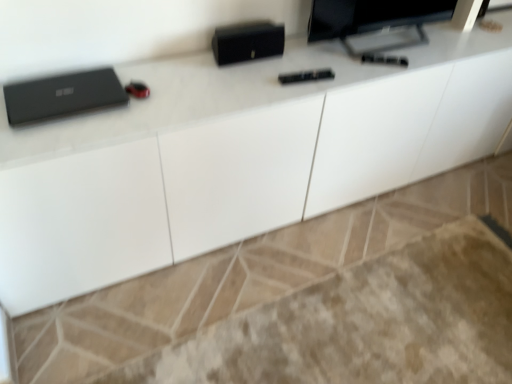
Describe the element at coordinates (375, 21) in the screenshot. Image resolution: width=512 pixels, height=384 pixels. I see `matte black monitor at upper right` at that location.

Locate an element on the screen. matte black monitor at upper right is located at coordinates (375, 21).

Measure the distance between point (405, 41) and camera.

Point (405, 41) and camera are 1.87 meters apart from each other.

Where is `matte black laptop at left`? This screenshot has width=512, height=384. matte black laptop at left is located at coordinates (62, 96).

Describe the element at coordinates (62, 96) in the screenshot. The height and width of the screenshot is (384, 512). I see `matte black laptop at left` at that location.

Locate an element on the screen. matte black monitor at upper right is located at coordinates (375, 21).

Considering the positions of objects matte black laptop at left and matte black monitor at upper right in the image provided, who is more to the right, matte black laptop at left or matte black monitor at upper right?

matte black monitor at upper right.

Is matte black laptop at left behind matte black monitor at upper right?

No, matte black laptop at left is closer to the viewer.

Is point (19, 94) closer or farther from the camera than point (328, 27)?

Point (19, 94) is positioned closer to the camera compared to point (328, 27).

From the image's perspective, which one is positioned lower, matte black laptop at left or matte black monitor at upper right?

matte black laptop at left, from the image's perspective.

From a real-world perspective, which object stands above the other?

matte black monitor at upper right.

Is matte black laptop at left wider than matte black monitor at upper right?

Indeed, matte black laptop at left has a greater width compared to matte black monitor at upper right.

From their relative heights in the image, would you say matte black laptop at left is taller or shorter than matte black monitor at upper right?

Considering their sizes, matte black laptop at left has less height than matte black monitor at upper right.

Between matte black laptop at left and matte black monitor at upper right, which one has larger size?

matte black monitor at upper right is bigger.

Is matte black laptop at left situated inside matte black monitor at upper right or outside?

matte black laptop at left is outside matte black monitor at upper right.

Does matte black laptop at left touch matte black monitor at upper right?

matte black laptop at left and matte black monitor at upper right are not in contact.

Is matte black laptop at left facing towards matte black monitor at upper right?

No, matte black laptop at left is not oriented towards matte black monitor at upper right.

How much distance is there between matte black laptop at left and matte black monitor at upper right?

A distance of 3.50 feet exists between matte black laptop at left and matte black monitor at upper right.

This screenshot has width=512, height=384. I want to click on computer monitor on the right of the matte black laptop at left, so click(x=375, y=21).

Is matte black monitor at upper right to the right of matte black laptop at left from the viewer's perspective?

Indeed, matte black monitor at upper right is positioned on the right side of matte black laptop at left.

Relative to matte black laptop at left, is matte black monitor at upper right in front or behind?

Visually, matte black monitor at upper right is located behind matte black laptop at left.

Which is behind, point (375, 51) or point (35, 118)?

The point (375, 51) is farther.

From the image's perspective, is matte black monitor at upper right on matte black laptop at left?

Yes.

From a real-world perspective, which object stands above the other?

matte black monitor at upper right is physically above.

Is matte black monitor at upper right wider or thinner than matte black laptop at left?

Clearly, matte black monitor at upper right has less width compared to matte black laptop at left.

Considering the relative sizes of matte black monitor at upper right and matte black laptop at left in the image provided, is matte black monitor at upper right taller than matte black laptop at left?

Indeed, matte black monitor at upper right has a greater height compared to matte black laptop at left.

Can you confirm if matte black monitor at upper right is smaller than matte black laptop at left?

Actually, matte black monitor at upper right might be larger than matte black laptop at left.

Is matte black monitor at upper right inside or outside of matte black laptop at left?

matte black monitor at upper right exists outside the volume of matte black laptop at left.

Is the surface of matte black monitor at upper right in direct contact with matte black laptop at left?

No, matte black monitor at upper right is not with matte black laptop at left.

Is matte black laptop at left at the back of matte black monitor at upper right?

No, matte black monitor at upper right is not facing away from matte black laptop at left.

How much distance is there between matte black monitor at upper right and matte black laptop at left?

matte black monitor at upper right and matte black laptop at left are 3.50 feet apart.

Image resolution: width=512 pixels, height=384 pixels. In order to click on computer monitor that is above the matte black laptop at left (from the image's perspective) in this screenshot , I will do `click(375, 21)`.

I want to click on laptop below the matte black monitor at upper right (from a real-world perspective), so click(62, 96).

Identify the location of computer monitor that appears above the matte black laptop at left (from a real-world perspective). (375, 21).